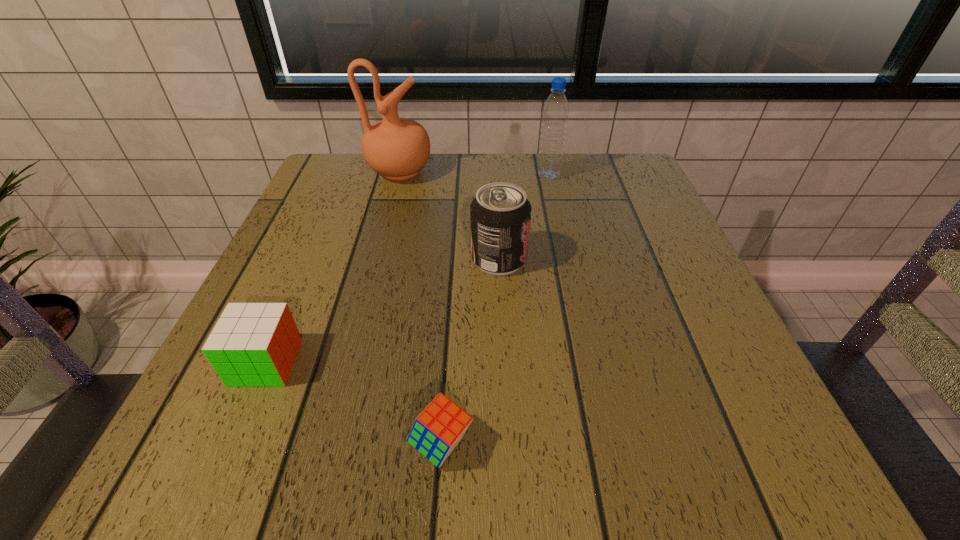
In order to click on the second object from left to right in this screenshot , I will do `click(397, 148)`.

Where is `the rightmost object`? The height and width of the screenshot is (540, 960). the rightmost object is located at coordinates (555, 113).

What are the coordinates of `the fourth shortest object` in the screenshot? It's located at (555, 113).

Locate an element on the screen. the third shortest object is located at coordinates (500, 214).

The height and width of the screenshot is (540, 960). What are the coordinates of `the third nearest object` in the screenshot? It's located at (500, 214).

You are a GUI agent. You are given a task and a screenshot of the screen. Output one action in this format:
    pyautogui.click(x=<x>, y=<y>)
    Task: Click on the leftmost object
    The image size is (960, 540).
    Given the screenshot: What is the action you would take?
    pyautogui.click(x=253, y=344)

Where is `the left cube`? the left cube is located at coordinates (253, 344).

Identify the location of the right cube. (437, 430).

Locate an element on the screen. The width and height of the screenshot is (960, 540). the nearest object is located at coordinates (437, 430).

Find the location of a particular element. free space located on the spout of the fourth object from right to left is located at coordinates (486, 172).